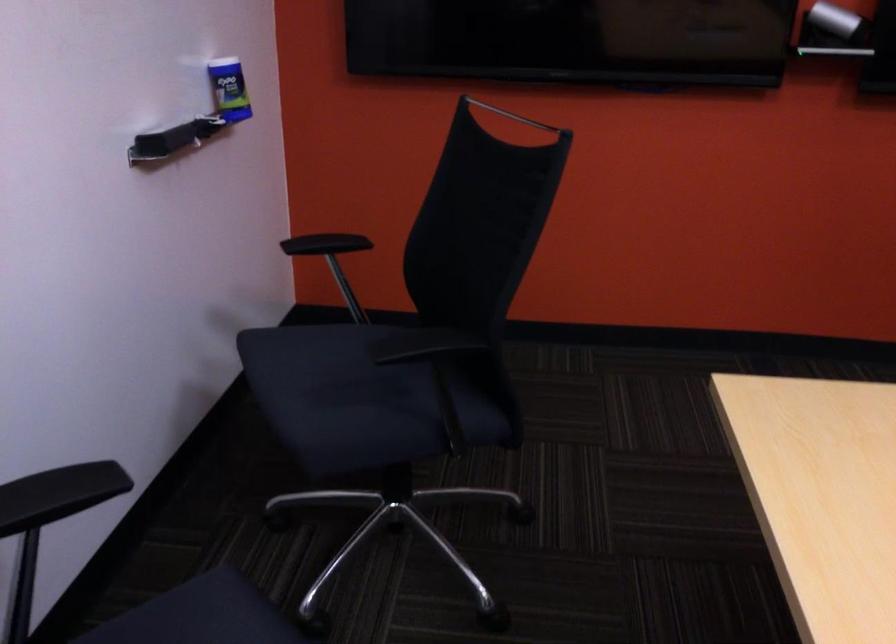
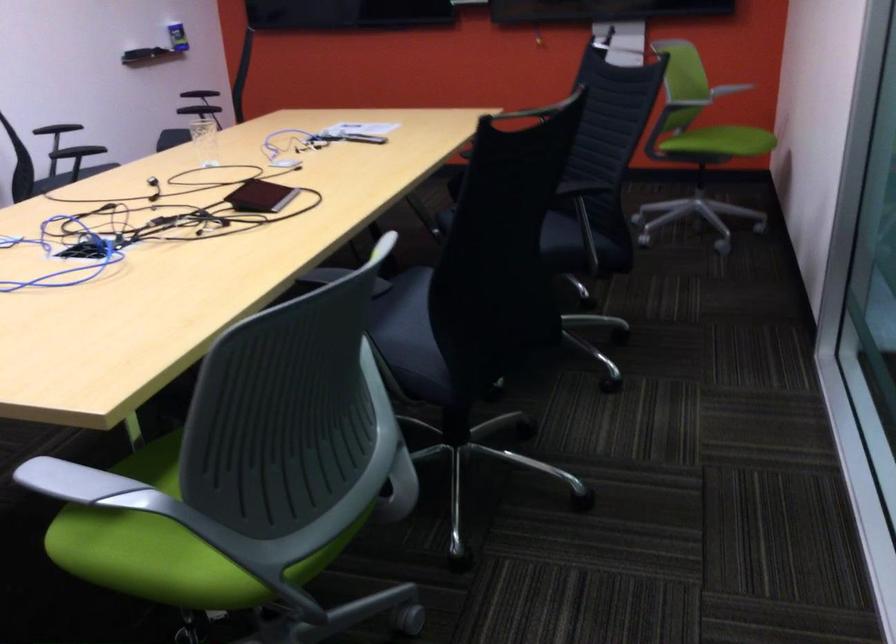
The images are taken continuously from a first-person perspective. In which direction are you moving?

The cameraman moved toward right, backward.